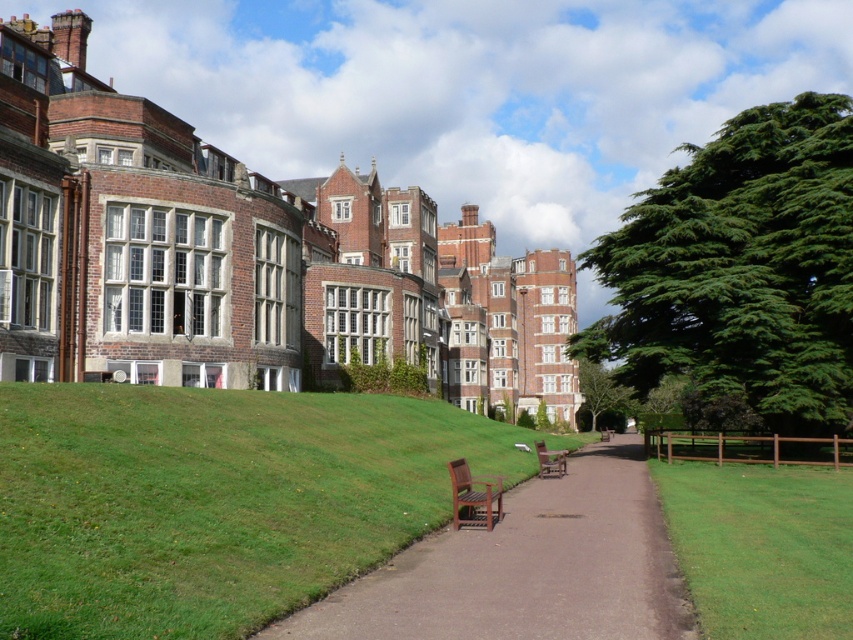
From the picture: You are planning to place a new bench exactly in the middle between the green grass at lower left and the wooden park bench at center. Is there enough space for the new bench?

The green grass at lower left is wider than the wooden park bench at center, so placing a bench in the middle would still leave enough space as the grass area is larger.

You are standing at the entrance of the historic building complex and want to sit down to rest. The green grass at lower left and the brown wooden bench at center are both visible. Which one is closer to your current position?

The brown wooden bench at center is closer to your current position because the green grass at lower left is located above it, meaning the bench is situated lower on the slope towards the pathway.

You are planning to place a new bench exactly the same size as the brown wooden bench at center in the scene. Based on the available space, will the green grass at lower left have enough room to accommodate the new bench without overlapping?

The green grass at lower left is larger in size than the brown wooden bench at center, so there is sufficient space to place another bench of the same size without overlapping.